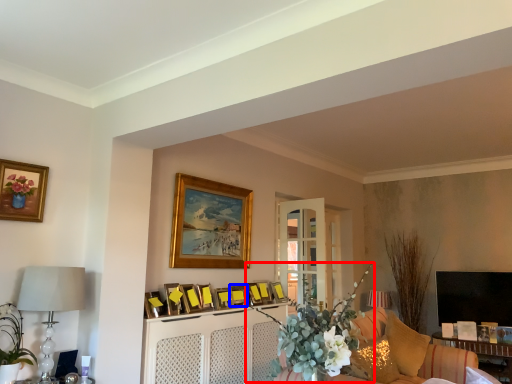
Question: Which object is closer to the camera taking this photo, floral arrangement (highlighted by a red box) or picture frame (highlighted by a blue box)?

Choices:
 (A) floral arrangement
 (B) picture frame

Answer: (A)